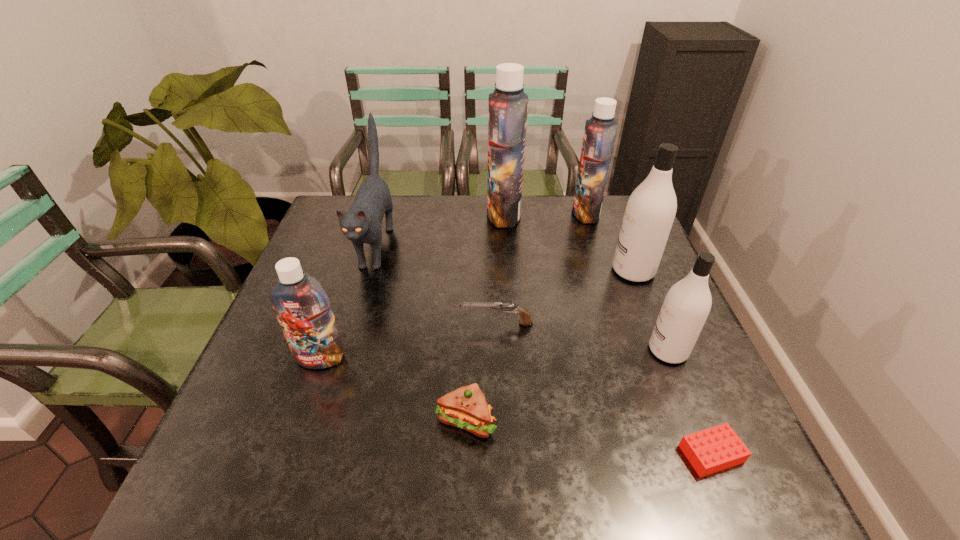
You are a GUI agent. You are given a task and a screenshot of the screen. Output one action in this format:
    pyautogui.click(x=<x>, y=<y>)
    Task: Click on the free location located 0.350m on the front-facing side of the bigger white shampoo
    The image size is (960, 540).
    Given the screenshot: What is the action you would take?
    pyautogui.click(x=484, y=271)

The image size is (960, 540). Identify the location of free spot located on the front-facing side of the bigger white shampoo. (571, 271).

Where is `vacant area situated 0.100m at the face of the cat`? vacant area situated 0.100m at the face of the cat is located at coordinates (354, 318).

At what (x,y) coordinates should I click in order to perform the action: click on vacant space situated on the front-facing side of the nearer white shampoo. Please return your answer as a coordinate pair (x, y). Looking at the image, I should click on (516, 350).

This screenshot has height=540, width=960. What are the coordinates of `vacant region located on the front-facing side of the nearer white shampoo` in the screenshot? It's located at (529, 350).

Image resolution: width=960 pixels, height=540 pixels. What are the coordinates of `vacant region located 0.260m on the front-facing side of the nearer white shampoo` in the screenshot? It's located at (534, 350).

The width and height of the screenshot is (960, 540). What are the coordinates of `free space located on the front label of the leftmost shampoo` in the screenshot? It's located at (270, 505).

Locate an element on the screen. vacant region located on the left of the sandwich is located at coordinates (411, 420).

The image size is (960, 540). What are the coordinates of `free point located aiming along the barrel of the eighth tallest object` in the screenshot? It's located at coord(369,323).

I want to click on vacant space situated 0.070m aiming along the barrel of the eighth tallest object, so click(431, 323).